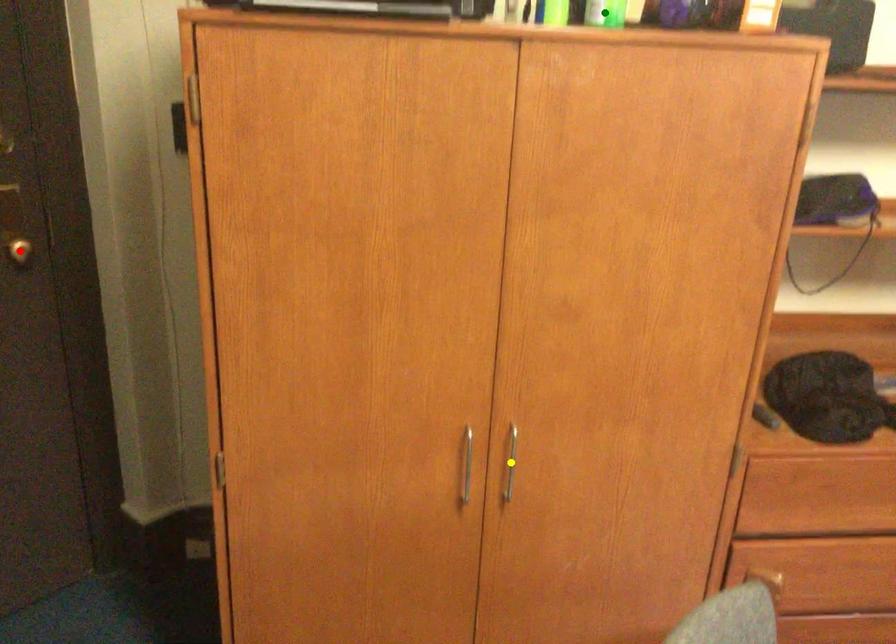
Order these from nearest to farthest:
- green point
- yellow point
- red point

green point → yellow point → red point